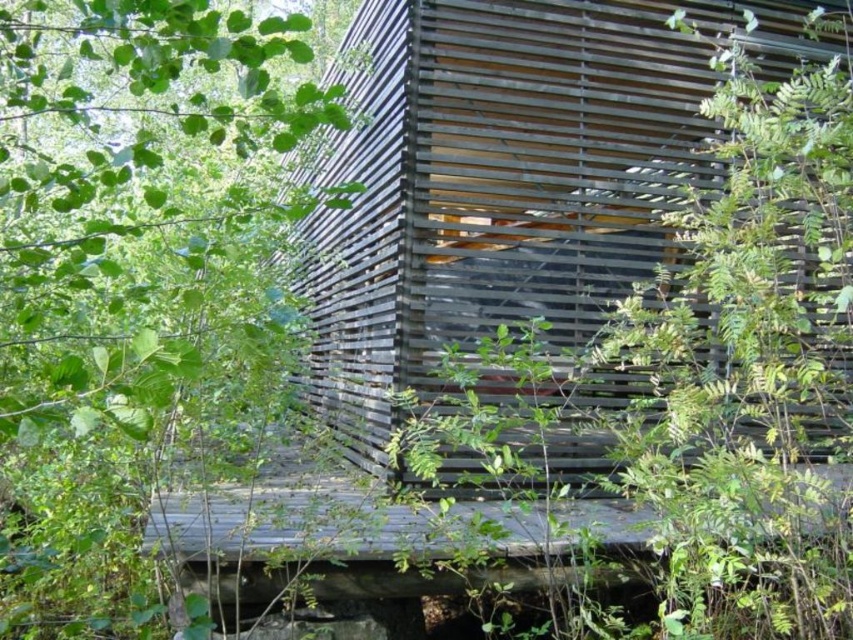
Is green leafy tree at left above weathered wood hut at center?

No, green leafy tree at left is not above weathered wood hut at center.

Consider the image. Can you confirm if green leafy tree at left is wider than weathered wood hut at center?

No, green leafy tree at left is not wider than weathered wood hut at center.

Image resolution: width=853 pixels, height=640 pixels. Describe the element at coordinates (136, 280) in the screenshot. I see `green leafy tree at left` at that location.

The width and height of the screenshot is (853, 640). Identify the location of green leafy tree at left. [136, 280].